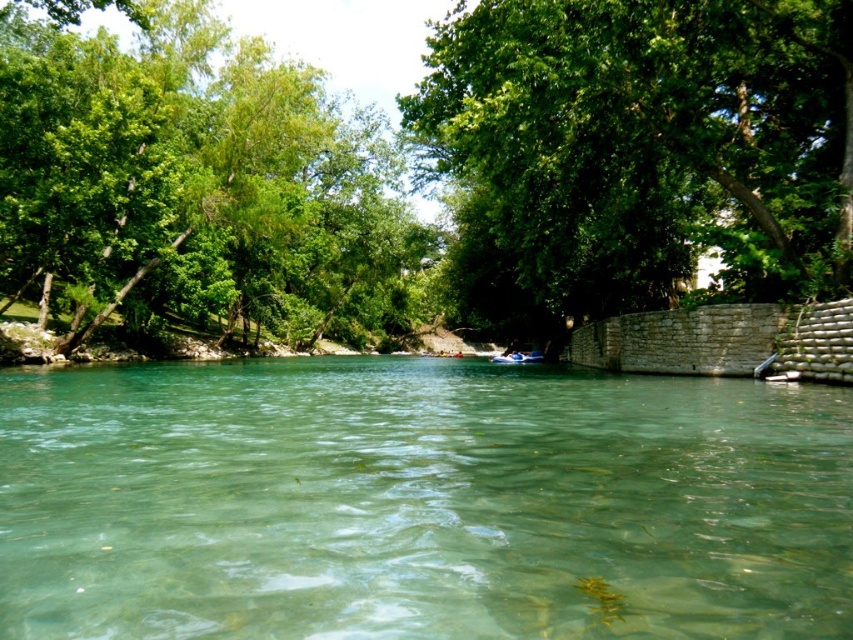
Which is more to the left, clear water at center or green leafy tree at center?

Positioned to the left is clear water at center.

Does clear water at center have a lesser height compared to green leafy tree at center?

Yes.

The image size is (853, 640). I want to click on clear water at center, so click(x=419, y=502).

Who is more forward, (815, 257) or (527, 353)?

Point (815, 257)

Is point (491, 112) in front of point (531, 356)?

Yes, point (491, 112) is in front of point (531, 356).

Is point (462, 92) farther from camera compared to point (525, 358)?

No, (462, 92) is in front of (525, 358).

Locate an element on the screen. green leafy tree at center is located at coordinates (639, 148).

Is clear water at center thinner than green leafy tree at left?

Yes.

Which is behind, point (619, 582) or point (177, 204)?

Positioned behind is point (177, 204).

Is point (97, 365) less distant than point (88, 141)?

No, it is behind (88, 141).

Find the location of `clear water at center`. clear water at center is located at coordinates (419, 502).